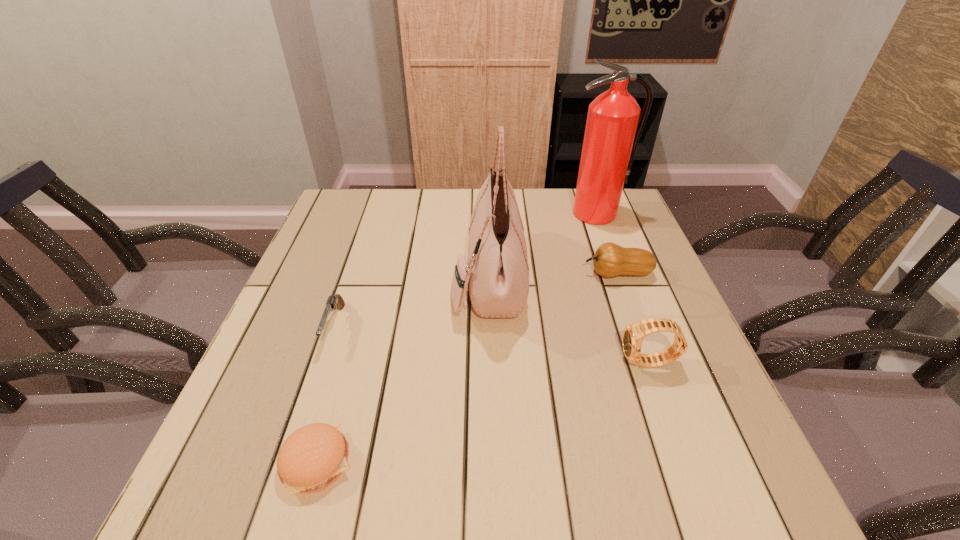
Find the location of `handbag that is at the far edge`. handbag that is at the far edge is located at coordinates (498, 272).

Where is `object located at the near edge`? object located at the near edge is located at coordinates (314, 456).

The height and width of the screenshot is (540, 960). I want to click on gun situated at the left edge, so click(333, 300).

Where is `patty that is positioned at the left edge`? patty that is positioned at the left edge is located at coordinates (314, 456).

This screenshot has width=960, height=540. Identify the location of fire extinguisher that is at the right edge. (611, 136).

Where is `watch that is at the right edge`? watch that is at the right edge is located at coordinates (633, 335).

Identify the location of gourd at the right edge. This screenshot has width=960, height=540. (610, 260).

This screenshot has height=540, width=960. I want to click on object at the near left corner, so click(314, 456).

I want to click on object located in the far right corner section of the desktop, so click(x=611, y=136).

In the image, there is a desktop. At what (x,y) coordinates should I click in order to perform the action: click on vacant space at the far edge. Please return your answer as a coordinate pair (x, y). This screenshot has width=960, height=540. Looking at the image, I should click on (387, 225).